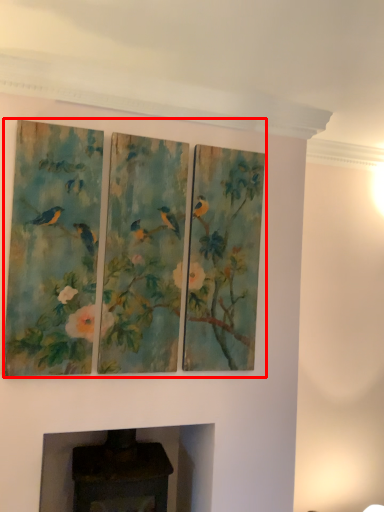
Question: Considering the relative positions of oil painting (annotated by the red box) and fireplace in the image provided, where is oil painting (annotated by the red box) located with respect to the staircase?

Choices:
 (A) right
 (B) left

Answer: (A)